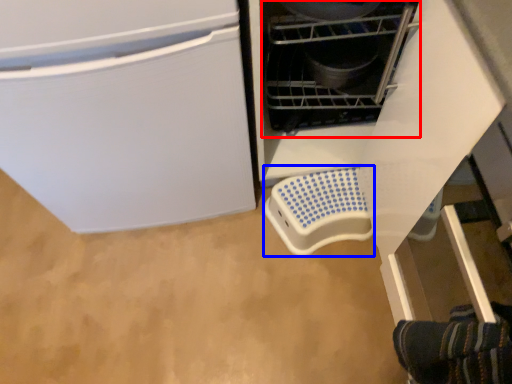
Question: Which of the following is the farthest to the observer, appliance (highlighted by a red box) or appliance (highlighted by a blue box)?

Choices:
 (A) appliance
 (B) appliance

Answer: (B)